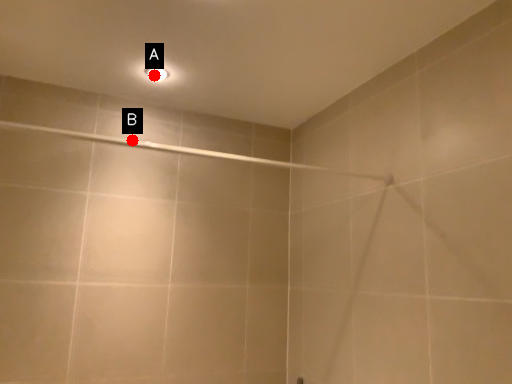
Question: Two points are circled on the image, labeled by A and B beside each circle. Which point is farther to the camera?

Choices:
 (A) A is further
 (B) B is further

Answer: (B)